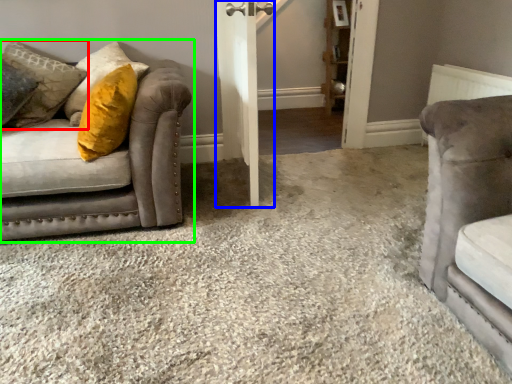
Question: Based on their relative distances, which object is farther from pillow (highlighted by a red box)? Choose from barn door (highlighted by a blue box) and studio couch (highlighted by a green box).

Choices:
 (A) barn door
 (B) studio couch

Answer: (A)